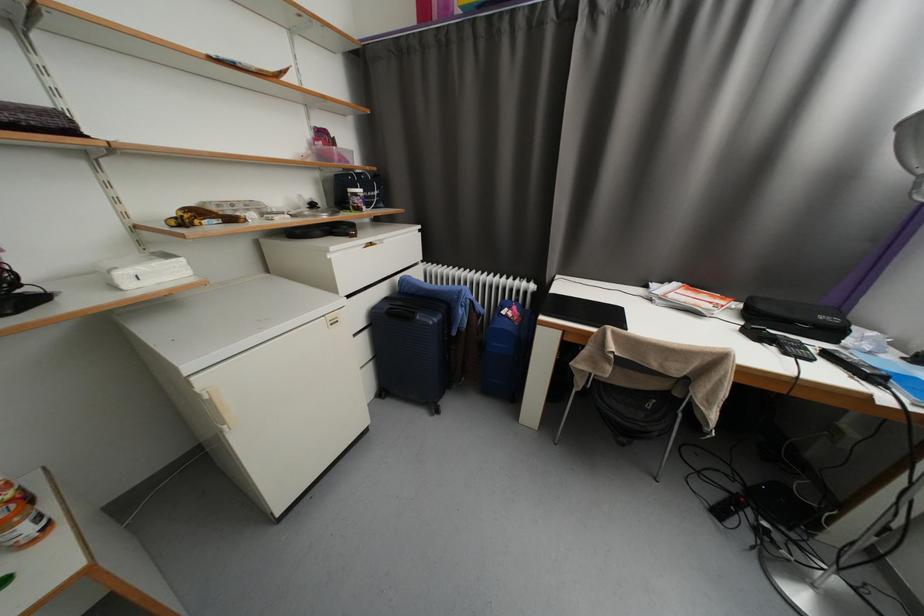
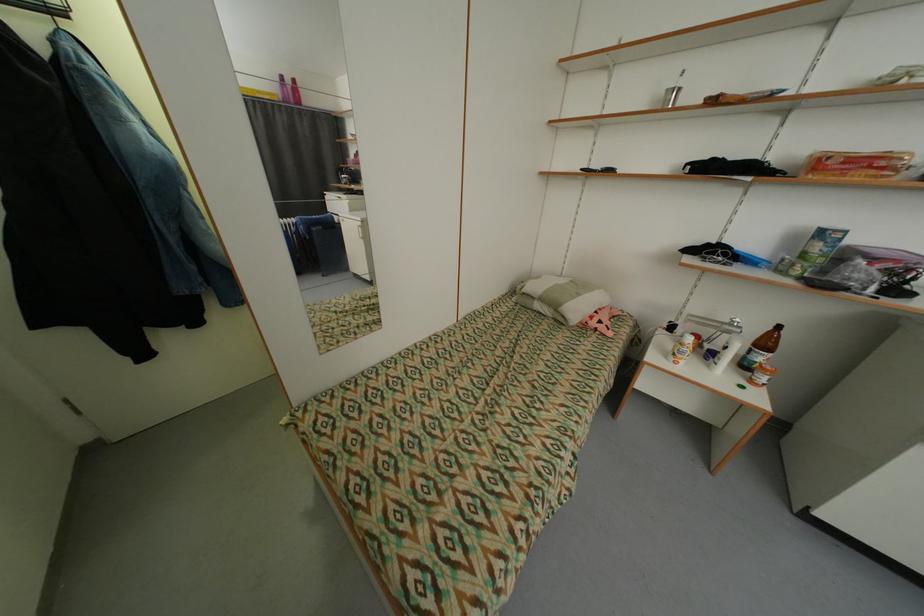
From the picture: Based on the continuous images, in which direction is the camera rotating?

The camera's rotation is toward left-down.